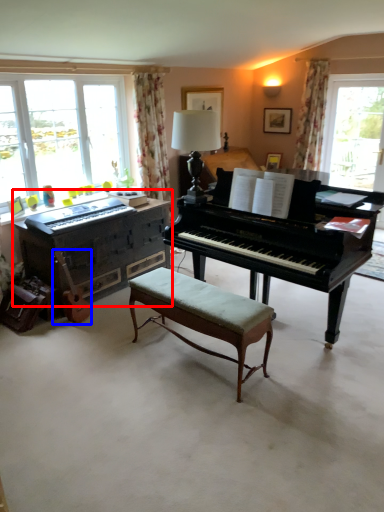
Question: Which object is further to the camera taking this photo, piano (highlighted by a red box) or instrument (highlighted by a blue box)?

Choices:
 (A) piano
 (B) instrument

Answer: (A)